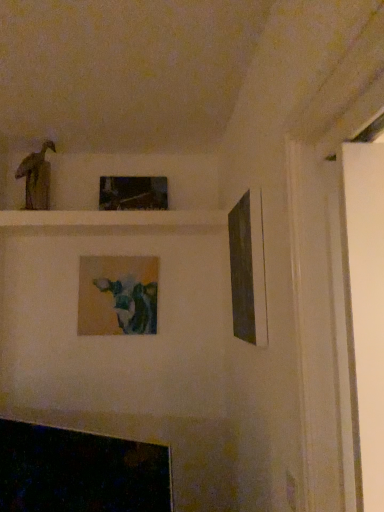
The image size is (384, 512). Describe the element at coordinates (118, 295) in the screenshot. I see `matte wooden picture frame at center, the first picture frame from the left` at that location.

This screenshot has height=512, width=384. Find the location of `matte black picture frame at right, which is the first picture frame from front to back`. matte black picture frame at right, which is the first picture frame from front to back is located at coordinates (248, 269).

Is matte wooden picture frame at center, the first picture frame from the left, facing away from metallic reflective frame at upper center, the first picture frame in the back-to-front sequence?

matte wooden picture frame at center, the first picture frame from the left, is not turned away from metallic reflective frame at upper center, the first picture frame in the back-to-front sequence.

From the image's perspective, is matte wooden picture frame at center, which is the 2th picture frame from back to front, over metallic reflective frame at upper center, which is the 3th picture frame in front-to-back order?

Actually, matte wooden picture frame at center, which is the 2th picture frame from back to front, appears below metallic reflective frame at upper center, which is the 3th picture frame in front-to-back order, in the image.

Is matte wooden picture frame at center, the first picture frame from the left, located outside metallic reflective frame at upper center, which is the 3th picture frame in front-to-back order?

Yes, matte wooden picture frame at center, the first picture frame from the left, is not within metallic reflective frame at upper center, which is the 3th picture frame in front-to-back order.

Considering the relative sizes of matte wooden picture frame at center, which is the 3th picture frame in right-to-left order, and metallic reflective frame at upper center, which is the 3th picture frame in front-to-back order, in the image provided, is matte wooden picture frame at center, which is the 3th picture frame in right-to-left order, wider than metallic reflective frame at upper center, which is the 3th picture frame in front-to-back order,?

No.

Does matte brown statue at upper left have a lesser width compared to matte wooden picture frame at center, which is the 3th picture frame in right-to-left order?

No.

Does matte brown statue at upper left have a larger size compared to matte wooden picture frame at center, which is the 3th picture frame in right-to-left order?

No.

Is matte brown statue at upper left oriented towards matte wooden picture frame at center, which is the 3th picture frame in right-to-left order?

No, matte brown statue at upper left does not turn towards matte wooden picture frame at center, which is the 3th picture frame in right-to-left order.

Identify the location of art positioned vertically above the matte wooden picture frame at center, the 2th picture frame from the front (from a real-world perspective). The image size is (384, 512). (36, 177).

Could you tell me if matte wooden picture frame at center, which is the 2th picture frame from back to front, is facing matte black picture frame at right, arranged as the first picture frame when viewed from the right?

Yes, matte wooden picture frame at center, which is the 2th picture frame from back to front, is oriented towards matte black picture frame at right, arranged as the first picture frame when viewed from the right.

In the scene shown: Considering the positions of objects matte wooden picture frame at center, the 2th picture frame from the front, and matte black picture frame at right, the 3th picture frame positioned from the left, in the image provided, who is more to the right, matte wooden picture frame at center, the 2th picture frame from the front, or matte black picture frame at right, the 3th picture frame positioned from the left,?

From the viewer's perspective, matte black picture frame at right, the 3th picture frame positioned from the left, appears more on the right side.

Considering the relative sizes of matte wooden picture frame at center, which is the 2th picture frame from back to front, and matte black picture frame at right, which is the first picture frame from front to back, in the image provided, is matte wooden picture frame at center, which is the 2th picture frame from back to front, taller than matte black picture frame at right, which is the first picture frame from front to back,?

Incorrect, the height of matte wooden picture frame at center, which is the 2th picture frame from back to front, is not larger of that of matte black picture frame at right, which is the first picture frame from front to back.

Is matte wooden picture frame at center, the first picture frame from the left, in contact with matte black picture frame at right, the 3th picture frame positioned from the left?

There is a gap between matte wooden picture frame at center, the first picture frame from the left, and matte black picture frame at right, the 3th picture frame positioned from the left.

Which picture frame is the 2nd one when counting from the right side of the matte brown statue at upper left? Please provide its 2D coordinates.

[(133, 193)]

Can you confirm if matte brown statue at upper left is shorter than metallic reflective frame at upper center, the first picture frame in the back-to-front sequence?

No, matte brown statue at upper left is not shorter than metallic reflective frame at upper center, the first picture frame in the back-to-front sequence.

Is there a large distance between matte brown statue at upper left and metallic reflective frame at upper center, which is the 2th picture frame from left to right?

No, matte brown statue at upper left is in close proximity to metallic reflective frame at upper center, which is the 2th picture frame from left to right.

Which of these two, matte brown statue at upper left or metallic reflective frame at upper center, which is the 3th picture frame in front-to-back order, is wider?

With larger width is metallic reflective frame at upper center, which is the 3th picture frame in front-to-back order.

From a real-world perspective, is metallic reflective frame at upper center, which is the 2th picture frame from left to right, over matte black picture frame at right, which is the first picture frame from front to back?

Yes.

Looking at their sizes, would you say metallic reflective frame at upper center, placed as the 2th picture frame when sorted from right to left, is wider or thinner than matte black picture frame at right, the 3th picture frame positioned from the left?

In the image, metallic reflective frame at upper center, placed as the 2th picture frame when sorted from right to left, appears to be wider than matte black picture frame at right, the 3th picture frame positioned from the left.

What are the coordinates of `picture frame that is the 2nd one when counting backward from the matte black picture frame at right, which is the third picture frame from back to front` in the screenshot? It's located at (133, 193).

Is metallic reflective frame at upper center, the first picture frame in the back-to-front sequence, looking in the opposite direction of matte black picture frame at right, arranged as the first picture frame when viewed from the right?

metallic reflective frame at upper center, the first picture frame in the back-to-front sequence, does not have its back to matte black picture frame at right, arranged as the first picture frame when viewed from the right.

Relative to matte wooden picture frame at center, which is the 3th picture frame in right-to-left order, is metallic reflective frame at upper center, the first picture frame in the back-to-front sequence, in front or behind?

In the image, metallic reflective frame at upper center, the first picture frame in the back-to-front sequence, appears behind matte wooden picture frame at center, which is the 3th picture frame in right-to-left order.

Which is less distant, (112, 191) or (145, 325)?

Clearly, point (112, 191) is more distant from the camera than point (145, 325).

Considering the positions of objects metallic reflective frame at upper center, placed as the 2th picture frame when sorted from right to left, and matte wooden picture frame at center, the first picture frame from the left, in the image provided, who is more to the left, metallic reflective frame at upper center, placed as the 2th picture frame when sorted from right to left, or matte wooden picture frame at center, the first picture frame from the left,?

matte wooden picture frame at center, the first picture frame from the left, is more to the left.

From a real-world perspective, who is located higher, metallic reflective frame at upper center, which is the 2th picture frame from left to right, or matte wooden picture frame at center, which is the 3th picture frame in right-to-left order?

metallic reflective frame at upper center, which is the 2th picture frame from left to right, from a real-world perspective.

Where is `art above the matte wooden picture frame at center, the first picture frame from the left (from a real-world perspective)`? This screenshot has height=512, width=384. art above the matte wooden picture frame at center, the first picture frame from the left (from a real-world perspective) is located at coordinates (36, 177).

Is there a large distance between matte wooden picture frame at center, which is the 2th picture frame from back to front, and matte brown statue at upper left?

No, matte wooden picture frame at center, which is the 2th picture frame from back to front, is not far away from matte brown statue at upper left.

Could you tell me if matte wooden picture frame at center, which is the 3th picture frame in right-to-left order, is turned towards matte brown statue at upper left?

No, matte wooden picture frame at center, which is the 3th picture frame in right-to-left order, is not oriented towards matte brown statue at upper left.

Which of these two, matte wooden picture frame at center, which is the 2th picture frame from back to front, or matte brown statue at upper left, stands taller?

matte wooden picture frame at center, which is the 2th picture frame from back to front.

Image resolution: width=384 pixels, height=512 pixels. Find the location of `picture frame that is behind the matte wooden picture frame at center, the first picture frame from the left`. picture frame that is behind the matte wooden picture frame at center, the first picture frame from the left is located at coordinates (133, 193).

The height and width of the screenshot is (512, 384). Identify the location of picture frame that is the 1st one when counting rightward from the matte brown statue at upper left. (118, 295).

Estimate the real-world distances between objects in this image. Which object is further from metallic reflective frame at upper center, which is the 3th picture frame in front-to-back order, matte black picture frame at right, arranged as the first picture frame when viewed from the right, or matte brown statue at upper left?

matte black picture frame at right, arranged as the first picture frame when viewed from the right, is positioned further to the anchor metallic reflective frame at upper center, which is the 3th picture frame in front-to-back order.

Considering their positions, is matte wooden picture frame at center, which is the 3th picture frame in right-to-left order, positioned closer to metallic reflective frame at upper center, placed as the 2th picture frame when sorted from right to left, than matte black picture frame at right, arranged as the first picture frame when viewed from the right?

matte wooden picture frame at center, which is the 3th picture frame in right-to-left order, is positioned closer to the anchor metallic reflective frame at upper center, placed as the 2th picture frame when sorted from right to left.

Which object lies nearer to the anchor point matte wooden picture frame at center, the first picture frame from the left, matte brown statue at upper left or metallic reflective frame at upper center, which is the 2th picture frame from left to right?

metallic reflective frame at upper center, which is the 2th picture frame from left to right, is closer to matte wooden picture frame at center, the first picture frame from the left.

When comparing their distances from matte black picture frame at right, arranged as the first picture frame when viewed from the right, does metallic reflective frame at upper center, which is the 2th picture frame from left to right, or matte wooden picture frame at center, the first picture frame from the left, seem closer?

metallic reflective frame at upper center, which is the 2th picture frame from left to right.

Estimate the real-world distances between objects in this image. Which object is further from matte brown statue at upper left, matte black picture frame at right, the 3th picture frame positioned from the left, or metallic reflective frame at upper center, which is the 2th picture frame from left to right?

Based on the image, matte black picture frame at right, the 3th picture frame positioned from the left, appears to be further to matte brown statue at upper left.

Which object lies further to the anchor point metallic reflective frame at upper center, which is the 3th picture frame in front-to-back order, matte black picture frame at right, which is the first picture frame from front to back, or matte wooden picture frame at center, the first picture frame from the left?

Based on the image, matte black picture frame at right, which is the first picture frame from front to back, appears to be further to metallic reflective frame at upper center, which is the 3th picture frame in front-to-back order.

Estimate the real-world distances between objects in this image. Which object is closer to matte brown statue at upper left, metallic reflective frame at upper center, the first picture frame in the back-to-front sequence, or matte wooden picture frame at center, the first picture frame from the left?

Among the two, metallic reflective frame at upper center, the first picture frame in the back-to-front sequence, is located nearer to matte brown statue at upper left.

Looking at this image, looking at the image, which one is located further to matte wooden picture frame at center, which is the 2th picture frame from back to front, matte black picture frame at right, which is the first picture frame from front to back, or metallic reflective frame at upper center, the first picture frame in the back-to-front sequence?

matte black picture frame at right, which is the first picture frame from front to back, lies further to matte wooden picture frame at center, which is the 2th picture frame from back to front, than the other object.

I want to click on art located between matte black picture frame at right, the 3th picture frame positioned from the left, and metallic reflective frame at upper center, the first picture frame in the back-to-front sequence, in the depth direction, so click(36, 177).

Where is `picture frame positioned between matte black picture frame at right, which is the third picture frame from back to front, and metallic reflective frame at upper center, placed as the 2th picture frame when sorted from right to left, from near to far`? The image size is (384, 512). picture frame positioned between matte black picture frame at right, which is the third picture frame from back to front, and metallic reflective frame at upper center, placed as the 2th picture frame when sorted from right to left, from near to far is located at coordinates (118, 295).